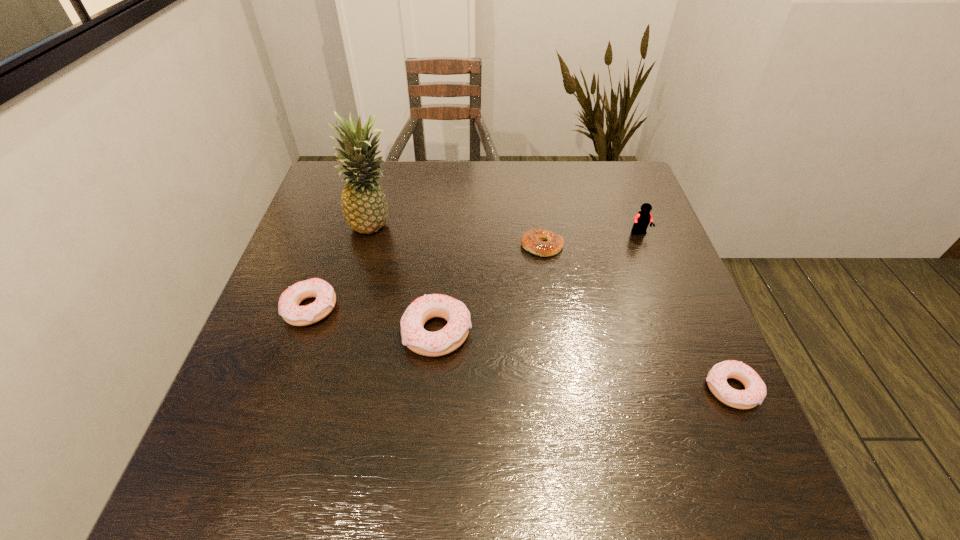
Locate an element on the screen. vacant space located 0.070m on the front of the second shortest doughnut is located at coordinates pyautogui.click(x=294, y=358).

At what (x,y) coordinates should I click in order to perform the action: click on blank space located 0.370m on the back of the third object from left to right. Please return your answer as a coordinate pair (x, y). The height and width of the screenshot is (540, 960). Looking at the image, I should click on (447, 207).

Locate an element on the screen. Image resolution: width=960 pixels, height=540 pixels. vacant space located 0.290m on the left of the nearest object is located at coordinates (554, 389).

The image size is (960, 540). Find the location of `vacant space located on the right of the pineapple`. vacant space located on the right of the pineapple is located at coordinates (480, 226).

Where is `free spot located 0.250m on the right of the shortest object`? free spot located 0.250m on the right of the shortest object is located at coordinates (660, 246).

This screenshot has height=540, width=960. What are the coordinates of `vacant space located on the front-facing side of the second tallest object` in the screenshot? It's located at (652, 265).

Locate an element on the screen. The image size is (960, 540). object that is at the near edge is located at coordinates (755, 389).

The image size is (960, 540). I want to click on doughnut at the left edge, so click(x=288, y=307).

Where is `pineapple that is at the left edge`? The height and width of the screenshot is (540, 960). pineapple that is at the left edge is located at coordinates (364, 206).

This screenshot has height=540, width=960. Find the location of `doughnut present at the right edge`. doughnut present at the right edge is located at coordinates (755, 389).